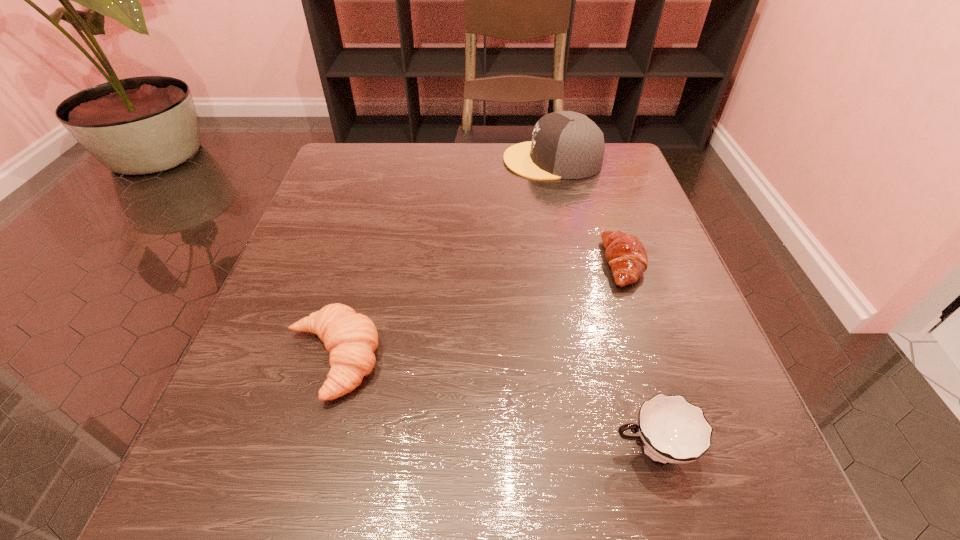
Locate an element on the screen. free space located on the side of the cup with the handle is located at coordinates (321, 449).

Find the location of a particular element. vacant space located 0.400m on the side of the cup with the handle is located at coordinates (297, 449).

I want to click on vacant space situated 0.390m on the side of the cup with the handle, so click(x=304, y=449).

Locate an element on the screen. vacant space located on the right of the leftmost object is located at coordinates (561, 360).

Image resolution: width=960 pixels, height=540 pixels. I want to click on free space located 0.140m on the left of the shorter crescent roll, so click(x=527, y=264).

At what (x,y) coordinates should I click in order to perform the action: click on object that is at the far edge. Please return your answer as a coordinate pair (x, y). Looking at the image, I should click on (565, 145).

Identify the location of object that is at the near edge. (672, 430).

Identify the location of object that is at the left edge. (351, 338).

Where is `cap present at the right edge`? Image resolution: width=960 pixels, height=540 pixels. cap present at the right edge is located at coordinates (565, 145).

Identify the location of cup present at the right edge. (672, 430).